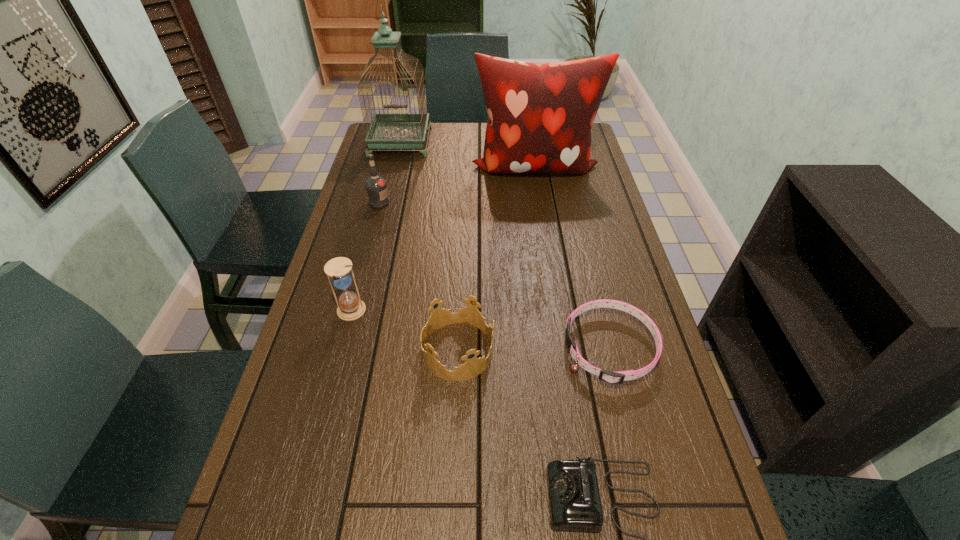
At what (x,y) coordinates should I click in order to perform the action: click on dog collar that is at the right edge. Please return your answer as a coordinate pair (x, y). Looking at the image, I should click on (617, 377).

The image size is (960, 540). I want to click on object present at the far left corner, so click(x=387, y=130).

Find the location of `object that is at the far right corner`. object that is at the far right corner is located at coordinates (540, 116).

At what (x,y) coordinates should I click in order to perform the action: click on vacant space at the left edge. Please return your answer as a coordinate pair (x, y). Looking at the image, I should click on (333, 443).

This screenshot has height=540, width=960. In order to click on free region at the right edge in this screenshot , I will do `click(588, 245)`.

This screenshot has width=960, height=540. Identify the location of free space between the third farthest object and the hourglass. (365, 257).

Identify the location of unoccupied area between the hourglass and the fifth nearest object. Image resolution: width=960 pixels, height=540 pixels. (365, 257).

You are a GUI agent. You are given a task and a screenshot of the screen. Output one action in this format:
    pyautogui.click(x=<x>, y=<y>)
    Task: Click on the free space that is in between the hourglass and the vodka
    
    Given the screenshot: What is the action you would take?
    pyautogui.click(x=365, y=257)

This screenshot has height=540, width=960. I want to click on empty location between the third farthest object and the cushion, so click(457, 185).

This screenshot has height=540, width=960. What are the coordinates of `free area in between the hourglass and the tiara` in the screenshot? It's located at (404, 331).